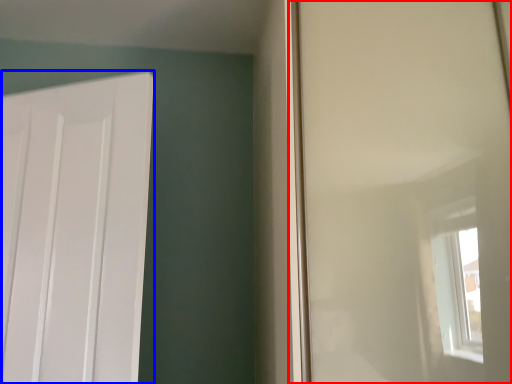
Question: Which of the following is the farthest to the observer, window screen (highlighted by a red box) or door (highlighted by a blue box)?

Choices:
 (A) window screen
 (B) door

Answer: (B)